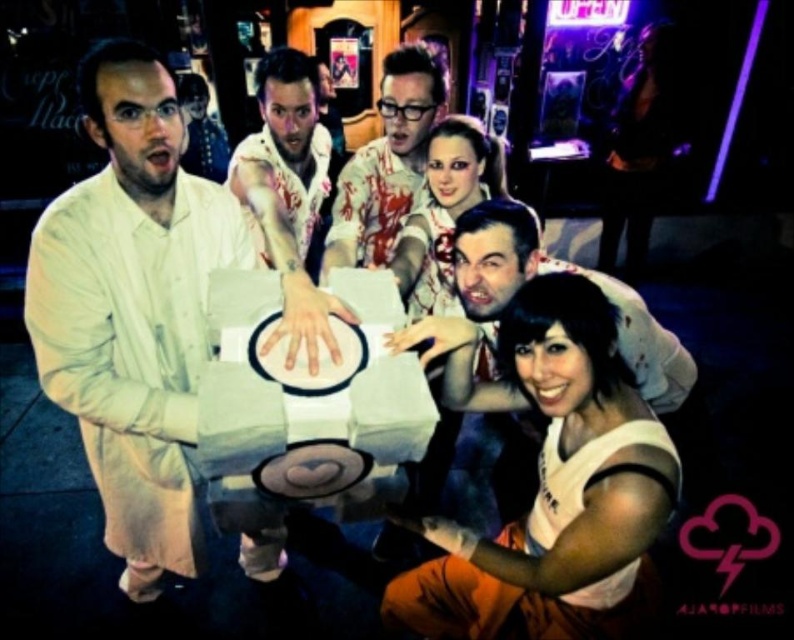
You are a photographer trying to capture the light beige lab coat at left in the image. According to the coordinates provided, where exactly should you focus your camera?

The light beige lab coat at left is located at coordinates point (133, 308), so you should focus your camera there.

You are a photographer trying to capture a group photo of the light beige lab coat at left and the matte white shirt at lower right. If you want to ensure both subjects are fully visible in the frame, which subject should you position closer to the camera to avoid cropping?

You should position the light beige lab coat at left closer to the camera because it might be wider than the matte white shirt at lower right, ensuring both fit within the frame without cropping.